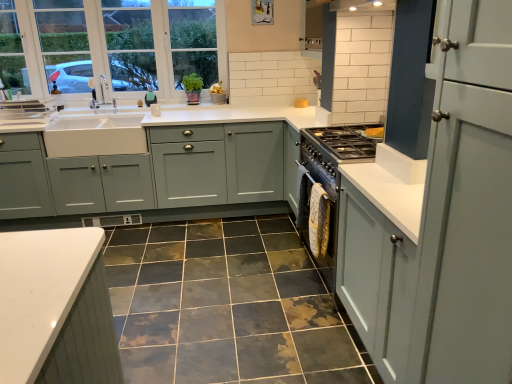
Question: Can you confirm if white glass window at upper left is shorter than matte gray cabinets at center, which is the second cabinetry in right-to-left order?

Choices:
 (A) yes
 (B) no

Answer: (B)

Question: Can you confirm if white glass window at upper left is positioned to the right of matte gray cabinets at center, the 1th cabinetry when ordered from back to front?

Choices:
 (A) no
 (B) yes

Answer: (A)

Question: Considering the relative sizes of white glass window at upper left and matte gray cabinets at center, arranged as the 1th cabinetry when viewed from the left, in the image provided, is white glass window at upper left wider than matte gray cabinets at center, arranged as the 1th cabinetry when viewed from the left,?

Choices:
 (A) no
 (B) yes

Answer: (A)

Question: From a real-world perspective, is white glass window at upper left under matte gray cabinets at center, arranged as the 1th cabinetry when viewed from the left?

Choices:
 (A) no
 (B) yes

Answer: (A)

Question: Considering the relative sizes of white glass window at upper left and matte gray cabinets at center, which is the second cabinetry in right-to-left order, in the image provided, is white glass window at upper left bigger than matte gray cabinets at center, which is the second cabinetry in right-to-left order,?

Choices:
 (A) no
 (B) yes

Answer: (A)

Question: Considering the positions of point (307, 374) and point (174, 142), is point (307, 374) closer or farther from the camera than point (174, 142)?

Choices:
 (A) farther
 (B) closer

Answer: (B)

Question: Based on their sizes in the image, would you say marble-like ceramic tile at center is bigger or smaller than matte gray cabinets at center, which appears as the second cabinetry when viewed from the front?

Choices:
 (A) big
 (B) small

Answer: (B)

Question: From their relative heights in the image, would you say marble-like ceramic tile at center is taller or shorter than matte gray cabinets at center, which is the second cabinetry in right-to-left order?

Choices:
 (A) tall
 (B) short

Answer: (B)

Question: From the image's perspective, is marble-like ceramic tile at center positioned above or below matte gray cabinets at center, which is the second cabinetry in right-to-left order?

Choices:
 (A) below
 (B) above

Answer: (A)

Question: Based on their sizes in the image, would you say teal fabric at upper left is bigger or smaller than white glass window at upper left?

Choices:
 (A) small
 (B) big

Answer: (A)

Question: Is point (155, 97) closer or farther from the camera than point (153, 33)?

Choices:
 (A) farther
 (B) closer

Answer: (A)

Question: Visually, is teal fabric at upper left positioned to the left or to the right of white glass window at upper left?

Choices:
 (A) left
 (B) right

Answer: (B)

Question: In terms of height, does teal fabric at upper left look taller or shorter compared to white glass window at upper left?

Choices:
 (A) tall
 (B) short

Answer: (B)

Question: Looking at their shapes, would you say matte gray cabinets at center, arranged as the 1th cabinetry when viewed from the left, is wider or thinner than matte gray cabinet at right, which is counted as the second cabinetry, starting from the left?

Choices:
 (A) wide
 (B) thin

Answer: (A)

Question: Considering the positions of matte gray cabinets at center, the 1th cabinetry when ordered from back to front, and matte gray cabinet at right, the second cabinetry positioned from the back, in the image, is matte gray cabinets at center, the 1th cabinetry when ordered from back to front, taller or shorter than matte gray cabinet at right, the second cabinetry positioned from the back,?

Choices:
 (A) short
 (B) tall

Answer: (B)